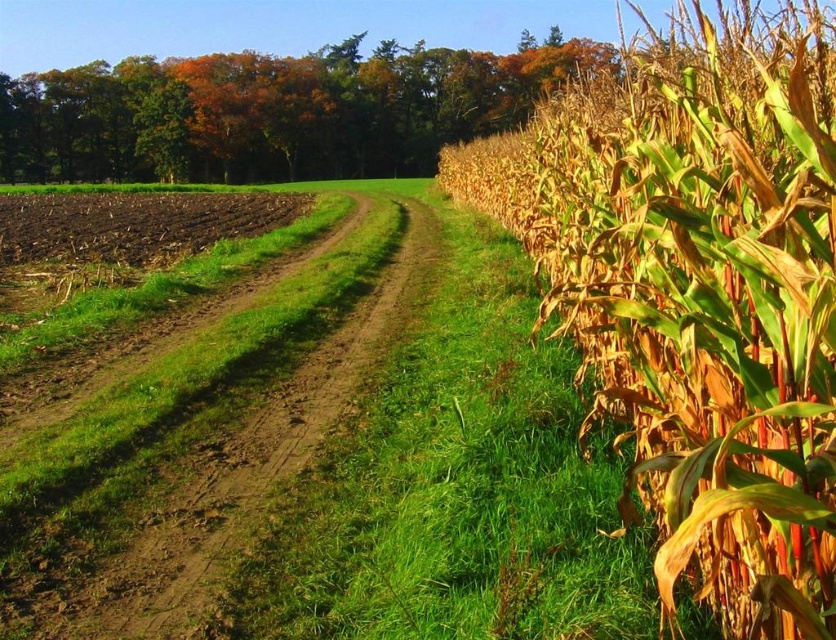
Question: Which object is closer to the camera taking this photo?

Choices:
 (A) brown dirt track at left
 (B) yellow-green dried corn at right

Answer: (B)

Question: In this image, where is yellow-green dried corn at right located relative to brown dirt track at left?

Choices:
 (A) above
 (B) below

Answer: (A)

Question: Which point appears closest to the camera in this image?

Choices:
 (A) (274, 339)
 (B) (804, 417)

Answer: (B)

Question: Is yellow-green dried corn at right closer to the viewer compared to brown dirt track at left?

Choices:
 (A) yes
 (B) no

Answer: (A)

Question: Does yellow-green dried corn at right come behind brown dirt track at left?

Choices:
 (A) yes
 (B) no

Answer: (B)

Question: Which point is closer to the camera?

Choices:
 (A) (697, 202)
 (B) (403, 202)

Answer: (A)